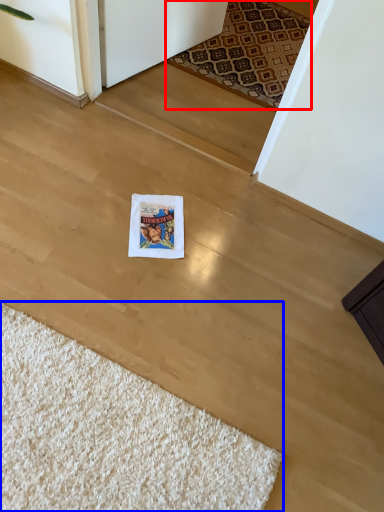
Question: Which object is further to the camera taking this photo, mat (highlighted by a red box) or doormat (highlighted by a blue box)?

Choices:
 (A) mat
 (B) doormat

Answer: (A)